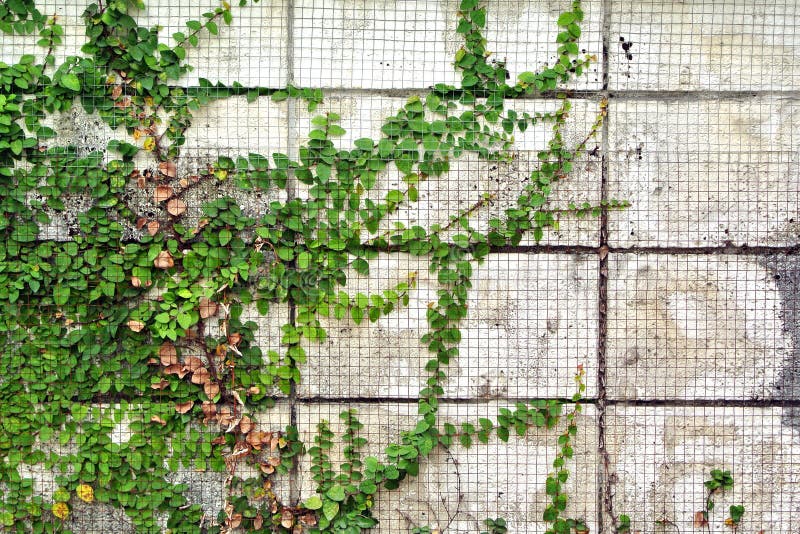
I want to click on plant, so click(x=93, y=310).